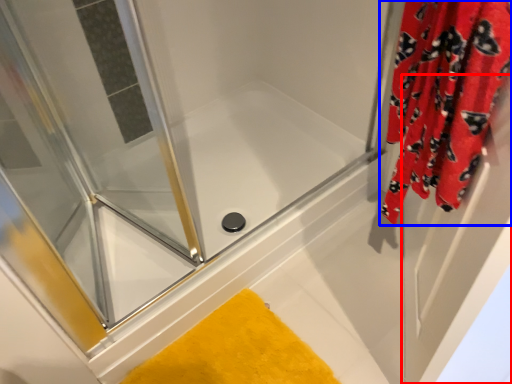
Question: Which object is closer to the camera taking this photo, screen door (highlighted by a red box) or curtain (highlighted by a blue box)?

Choices:
 (A) screen door
 (B) curtain

Answer: (B)